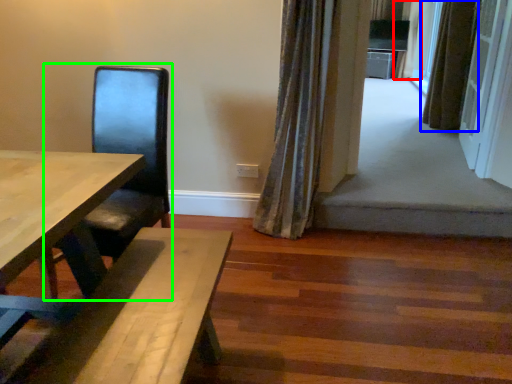
Question: Considering the real-world distances, which object is closest to curtain (highlighted by a red box)? curtain (highlighted by a blue box) or armchair (highlighted by a green box).

Choices:
 (A) curtain
 (B) armchair

Answer: (A)